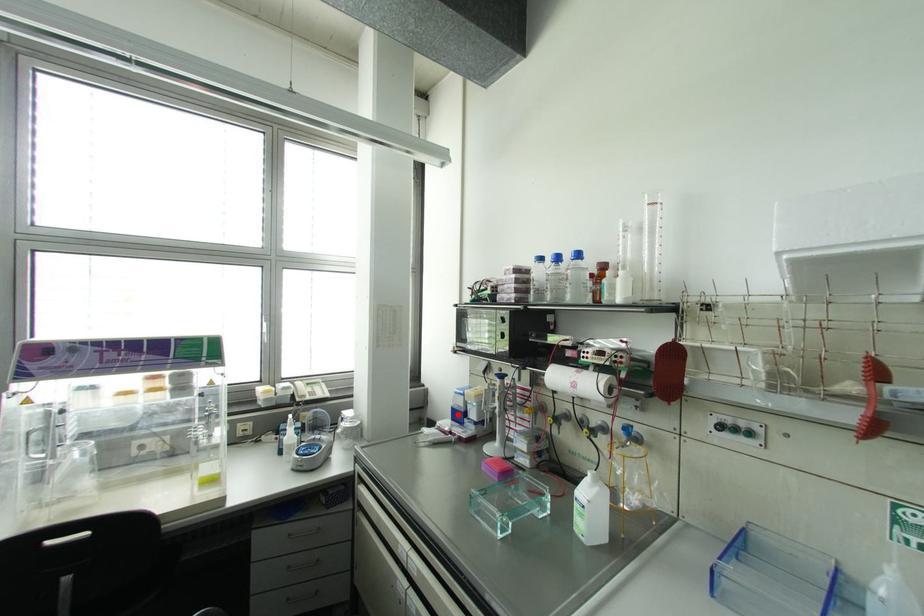
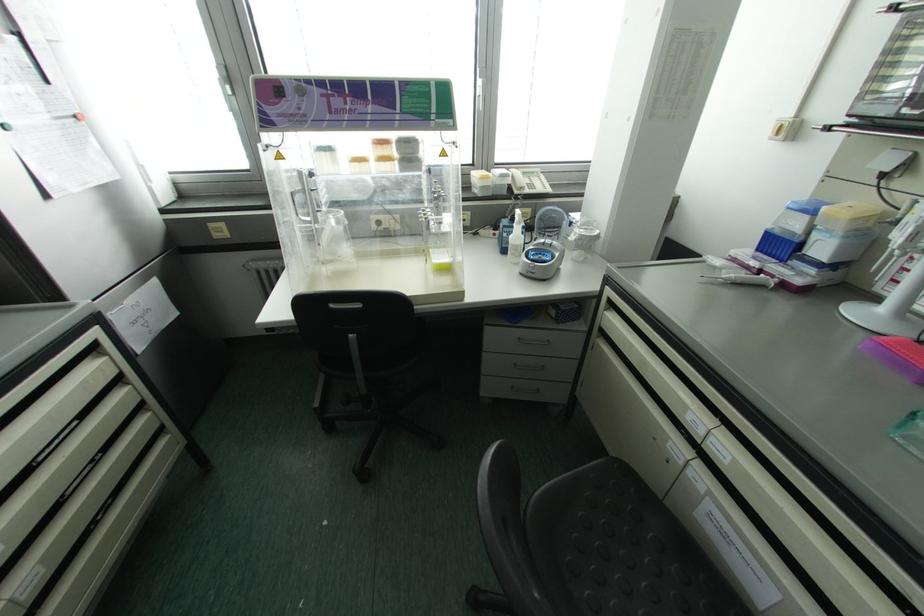
Find the pixel in the second image that matches the highlighted location in the first image.

(777, 245)